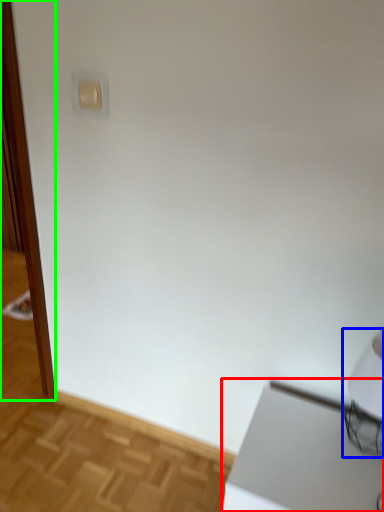
Question: Which is nearer to the table (highlighted by a red box)? table lamp (highlighted by a blue box) or screen door (highlighted by a green box).

Choices:
 (A) table lamp
 (B) screen door

Answer: (A)